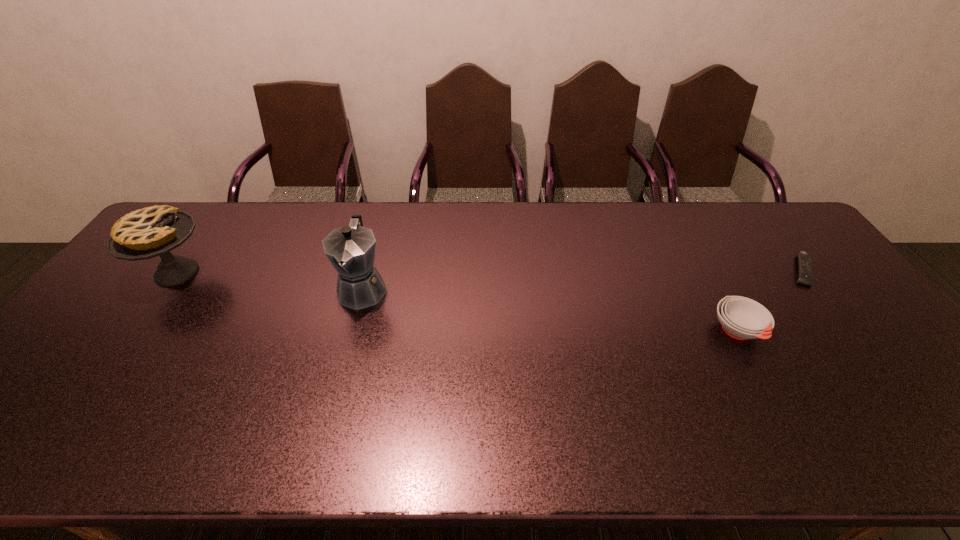
You are a GUI agent. You are given a task and a screenshot of the screen. Output one action in this format:
    pyautogui.click(x=<x>, y=<y>)
    Task: Click on the object that is the third nearest to the remote control
    This screenshot has height=540, width=960.
    Given the screenshot: What is the action you would take?
    pyautogui.click(x=149, y=232)

This screenshot has width=960, height=540. I want to click on vacant region that satisfies the following two spatial constraints: 1. at the spout of the soup bowl; 2. on the left side of the third object from right to left, so click(351, 331).

I want to click on vacant area that satisfies the following two spatial constraints: 1. on the cut side of the leftmost object; 2. on the left side of the soup bowl, so click(135, 331).

Where is `free location that satisfies the following two spatial constraints: 1. on the cut side of the second tallest object; 2. on the right side of the second shortest object`? The height and width of the screenshot is (540, 960). free location that satisfies the following two spatial constraints: 1. on the cut side of the second tallest object; 2. on the right side of the second shortest object is located at coordinates (135, 331).

What are the coordinates of `free space that satisfies the following two spatial constraints: 1. on the back side of the second object from right to left; 2. on the cut side of the pie` in the screenshot? It's located at (707, 273).

Where is `vacant space that satisfies the following two spatial constraints: 1. on the cut side of the second tallest object; 2. on the back side of the second object from right to left`? This screenshot has width=960, height=540. vacant space that satisfies the following two spatial constraints: 1. on the cut side of the second tallest object; 2. on the back side of the second object from right to left is located at coordinates (135, 331).